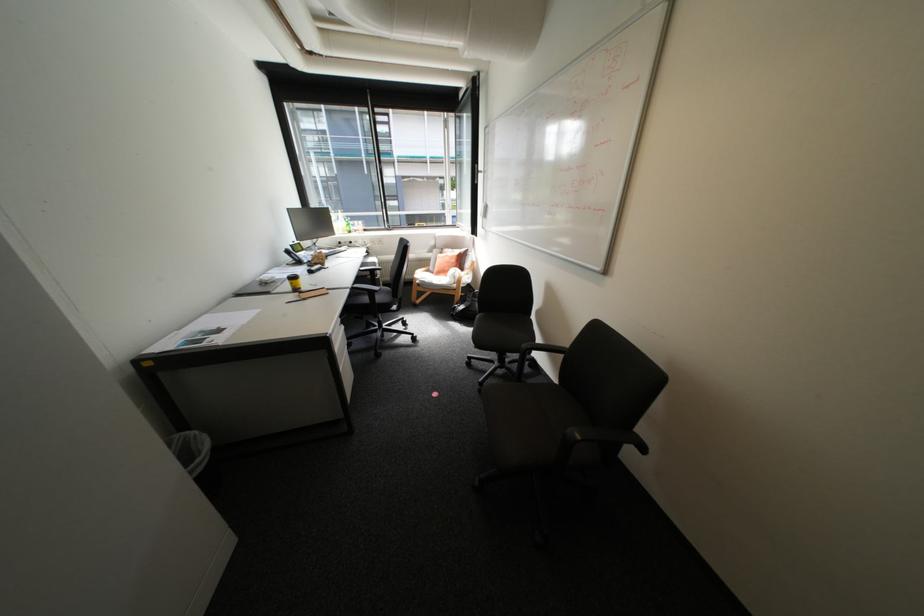
This screenshot has height=616, width=924. I want to click on chair sitting surface, so click(x=532, y=424).